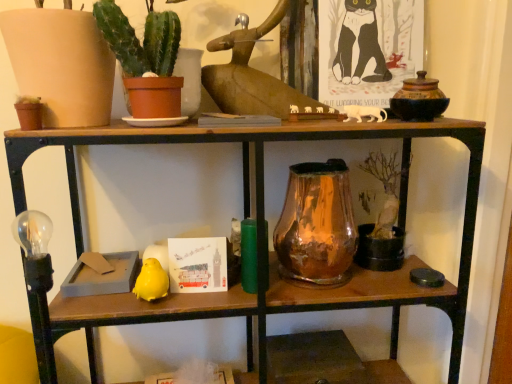
Question: Is yellow matte bird at lower left directly adjacent to amber glass vase at center?

Choices:
 (A) no
 (B) yes

Answer: (A)

Question: From a real-world perspective, is yellow matte bird at lower left physically above amber glass vase at center?

Choices:
 (A) yes
 (B) no

Answer: (B)

Question: Considering the relative positions of yellow matte bird at lower left and amber glass vase at center in the image provided, is yellow matte bird at lower left behind amber glass vase at center?

Choices:
 (A) yes
 (B) no

Answer: (B)

Question: Would you say yellow matte bird at lower left is outside amber glass vase at center?

Choices:
 (A) no
 (B) yes

Answer: (B)

Question: Is yellow matte bird at lower left wider than amber glass vase at center?

Choices:
 (A) yes
 (B) no

Answer: (B)

Question: Is yellow matte bird at lower left in front of or behind green matte cactus at upper left in the image?

Choices:
 (A) front
 (B) behind

Answer: (B)

Question: Visually, is yellow matte bird at lower left positioned to the left or to the right of green matte cactus at upper left?

Choices:
 (A) right
 (B) left

Answer: (B)

Question: From the image's perspective, is yellow matte bird at lower left located above or below green matte cactus at upper left?

Choices:
 (A) below
 (B) above

Answer: (A)

Question: From a real-world perspective, relative to green matte cactus at upper left, is yellow matte bird at lower left vertically above or below?

Choices:
 (A) below
 (B) above

Answer: (A)

Question: Considering their positions, is amber glass vase at center located in front of or behind yellow matte bird at lower left?

Choices:
 (A) front
 (B) behind

Answer: (B)

Question: Looking at the image, does amber glass vase at center seem bigger or smaller compared to yellow matte bird at lower left?

Choices:
 (A) small
 (B) big

Answer: (B)

Question: Considering the positions of amber glass vase at center and yellow matte bird at lower left in the image, is amber glass vase at center wider or thinner than yellow matte bird at lower left?

Choices:
 (A) thin
 (B) wide

Answer: (B)

Question: From a real-world perspective, relative to yellow matte bird at lower left, is amber glass vase at center vertically above or below?

Choices:
 (A) below
 (B) above

Answer: (B)

Question: From their relative heights in the image, would you say yellow matte bird at lower left is taller or shorter than amber glass vase at center?

Choices:
 (A) short
 (B) tall

Answer: (A)

Question: From a real-world perspective, relative to amber glass vase at center, is yellow matte bird at lower left vertically above or below?

Choices:
 (A) above
 (B) below

Answer: (B)